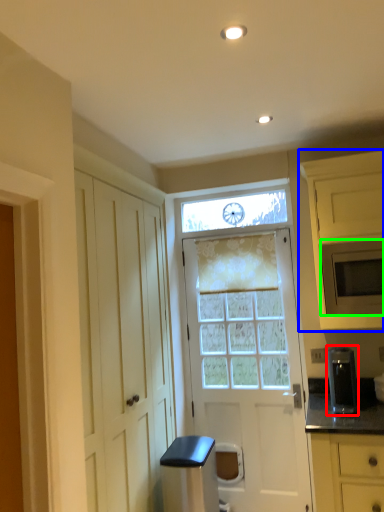
Question: Considering the real-world distances, which object is farthest from appliance (highlighted by a red box)? cabinetry (highlighted by a blue box) or microwave oven (highlighted by a green box)?

Choices:
 (A) cabinetry
 (B) microwave oven

Answer: (A)